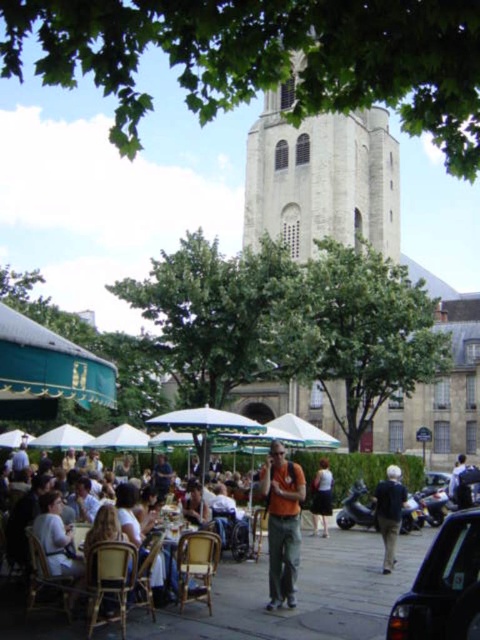
Based on the photo, you are a photographer standing at the edge of the outdoor cafe. You want to take a photo that includes both the orange fabric shirt at center and the white cotton shirt at center. Given that your camera has a maximum focus range of 30 feet, will you be able to capture both subjects in focus?

The orange fabric shirt at center and white cotton shirt at center are 33.83 feet apart, which exceeds the camera maximum focus range of 30 feet. Therefore, you cannot capture both subjects in focus.

You are a pedestrian standing at the edge of the outdoor cafe scene. You want to walk from your current position to the historic stone tower in the background. Is there any object blocking your path between the black glossy car at lower right and the white cotton shirt at center?

The black glossy car at lower right is in front of the white cotton shirt at center, so the car is blocking the path between them. To reach the tower, you should go around the car or the shirt.

You are a photographer trying to capture a photo of the white cotton shirt at center without the green leafy tree at upper center blocking it. Since you can only move left or right, which direction should you move to ensure the tree doesn work interfere?

The green leafy tree at upper center is wider than the white cotton shirt at center. To avoid the tree blocking the shirt, move to the left or right until the tree is out of the frame, as its greater width means it occupies more space and could easily overlap the shirt if not positioned carefully.